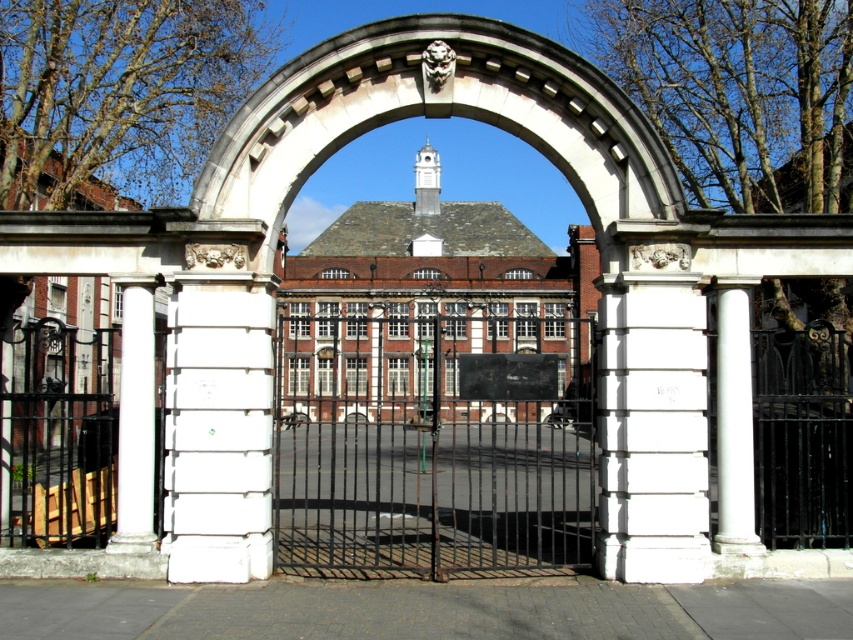
Question: In this image, where is black wrought iron gate at center located relative to white smooth pillar at center?

Choices:
 (A) above
 (B) below

Answer: (B)

Question: Which object appears farthest from the camera in this image?

Choices:
 (A) white marble column at right
 (B) white stone archway at center

Answer: (A)

Question: Which object is positioned farthest from the white smooth pillar at center?

Choices:
 (A) white marble column at left
 (B) white marble column at right
 (C) white stone archway at center
 (D) black wrought iron gate at center

Answer: (D)

Question: Can you confirm if white smooth pillar at center is positioned above white marble column at right?

Choices:
 (A) yes
 (B) no

Answer: (B)

Question: Which point is farther to the camera?

Choices:
 (A) (128, 458)
 (B) (676, 442)
 (C) (741, 417)
 (D) (265, 560)

Answer: (C)

Question: Can you confirm if white stone archway at center is positioned above white smooth pillar at center?

Choices:
 (A) yes
 (B) no

Answer: (B)